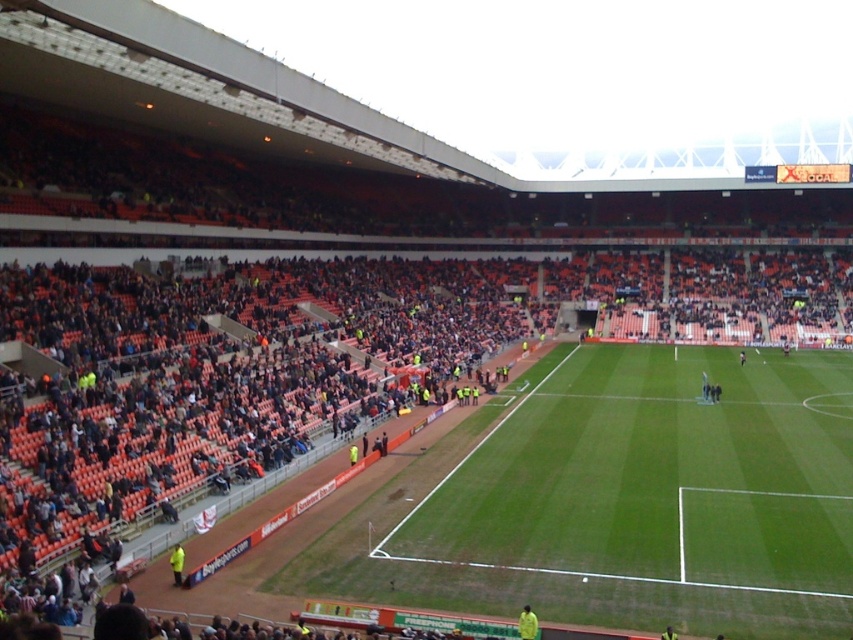
Question: Can you confirm if green grass football field at center is positioned to the right of yellow jacket at lower left?

Choices:
 (A) no
 (B) yes

Answer: (B)

Question: Does green grass football field at center come in front of yellow jacket at lower left?

Choices:
 (A) no
 (B) yes

Answer: (B)

Question: Which point appears farthest from the camera in this image?

Choices:
 (A) (178, 554)
 (B) (524, 632)
 (C) (706, 474)

Answer: (C)

Question: Among these points, which one is nearest to the camera?

Choices:
 (A) (527, 632)
 (B) (177, 573)

Answer: (A)

Question: Among these objects, which one is farthest from the camera?

Choices:
 (A) yellow matte jacket at lower center
 (B) yellow jacket at lower left
 (C) green grass football field at center

Answer: (B)

Question: Can you confirm if green grass football field at center is positioned above yellow matte jacket at lower center?

Choices:
 (A) no
 (B) yes

Answer: (B)